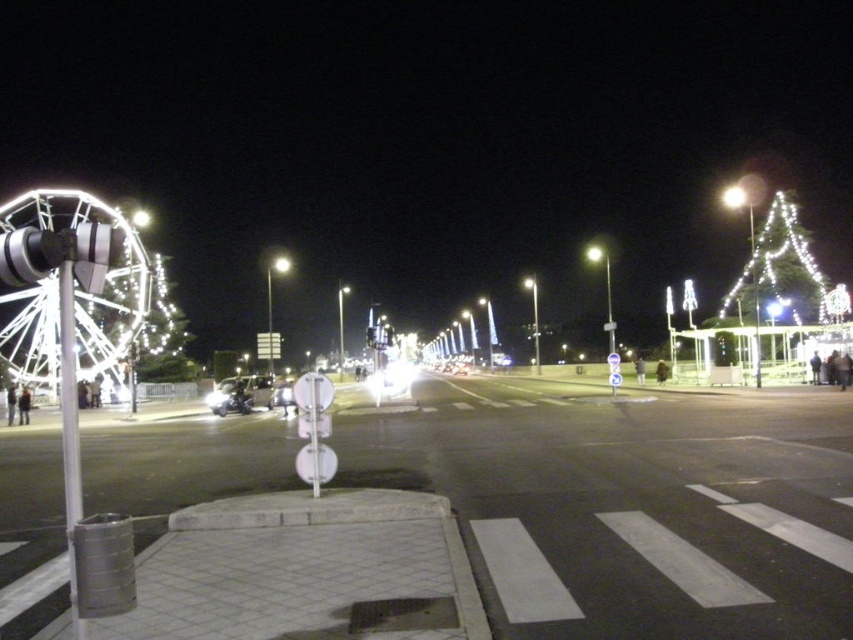
Who is shorter, white illuminated ferris wheel at left or bright metallic streetlight at upper right?

bright metallic streetlight at upper right

Is point (137, 291) in front of point (738, 195)?

Yes, it is in front of point (738, 195).

Does point (48, 221) come behind point (741, 188)?

No, it is in front of (741, 188).

The height and width of the screenshot is (640, 853). In order to click on white illuminated ferris wheel at left in this screenshot , I will do `click(103, 284)`.

Can you confirm if white illuminated ferris wheel at left is positioned to the right of shiny silver car at center?

In fact, white illuminated ferris wheel at left is to the left of shiny silver car at center.

Does white illuminated ferris wheel at left have a smaller size compared to shiny silver car at center?

Incorrect, white illuminated ferris wheel at left is not smaller in size than shiny silver car at center.

Where is `white illuminated ferris wheel at left`? white illuminated ferris wheel at left is located at coordinates (103, 284).

Does illuminated plastic tree at right have a larger size compared to shiny silver car at center?

Yes, illuminated plastic tree at right is bigger than shiny silver car at center.

Who is positioned more to the left, illuminated plastic tree at right or shiny silver car at center?

shiny silver car at center

Which is behind, point (735, 280) or point (263, 388)?

Point (735, 280)

Locate an element on the screen. illuminated plastic tree at right is located at coordinates (779, 268).